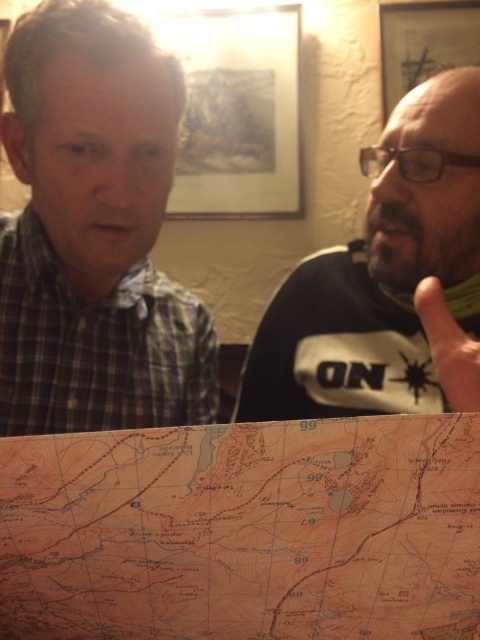
You are a delivery drone with a wingspan of 12 inches. You need to fly from the green plaid shirt at upper left to the orange paper map at lower center. Is there enough space between them for you to pass through?

The distance between the green plaid shirt at upper left and the orange paper map at lower center is 14.85 inches. Since your wingspan is 12 inches, there is sufficient space for you to pass through.

You are a delivery person who needs to place a 10 inch wide package between the green plaid shirt at upper left and the bearded man at right. Is there enough space?

The green plaid shirt at upper left is 8.42 inches from bearded man at right. Since the package is 10 inches wide, it won not fit between them as the distance is less than the package width.

You are a delivery robot with a 12 inch wide package that needs to be placed between the orange paper map at lower center and the bearded man at right. Can the package fit in the space between them?

The distance between the orange paper map at lower center and the bearded man at right is 12.38 inches, so the 12 inch wide package can fit in the space between them since it is slightly narrower than the available space.